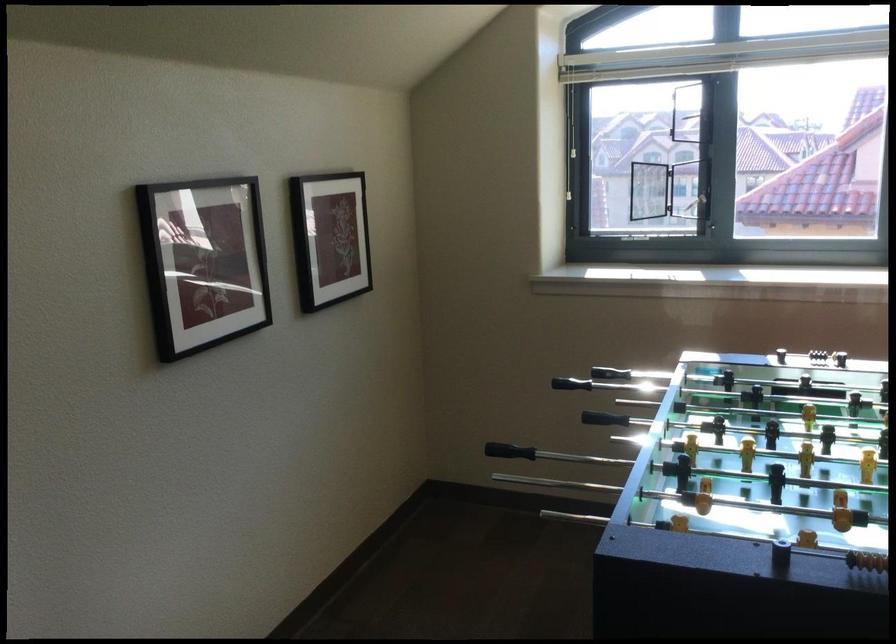
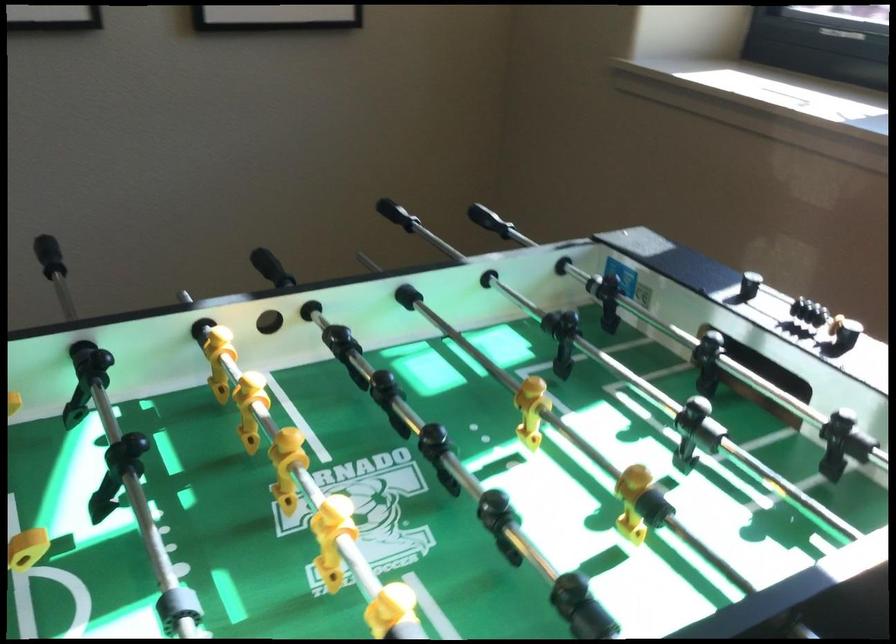
Where in the second image is the point corresponding to pixel 385 410 from the first image?

(397, 214)